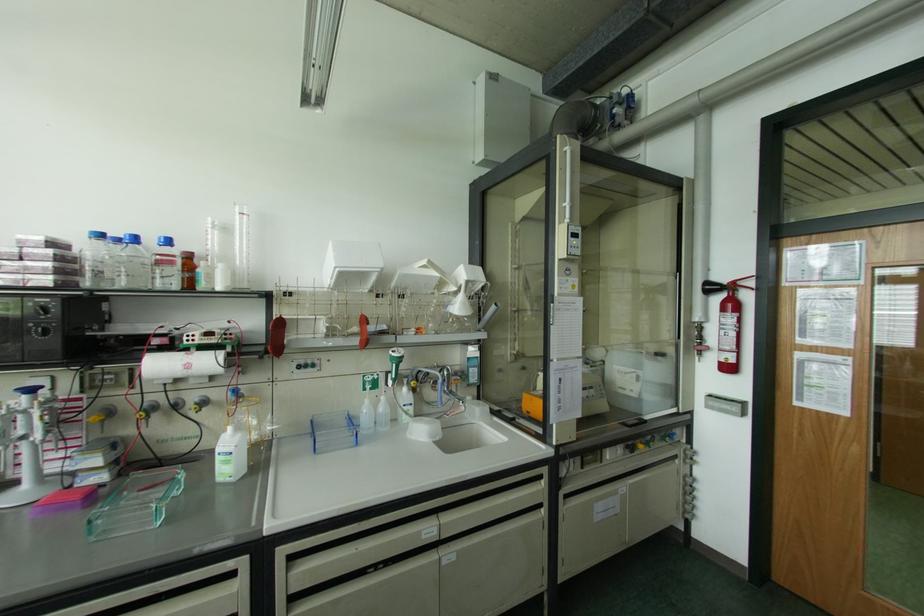
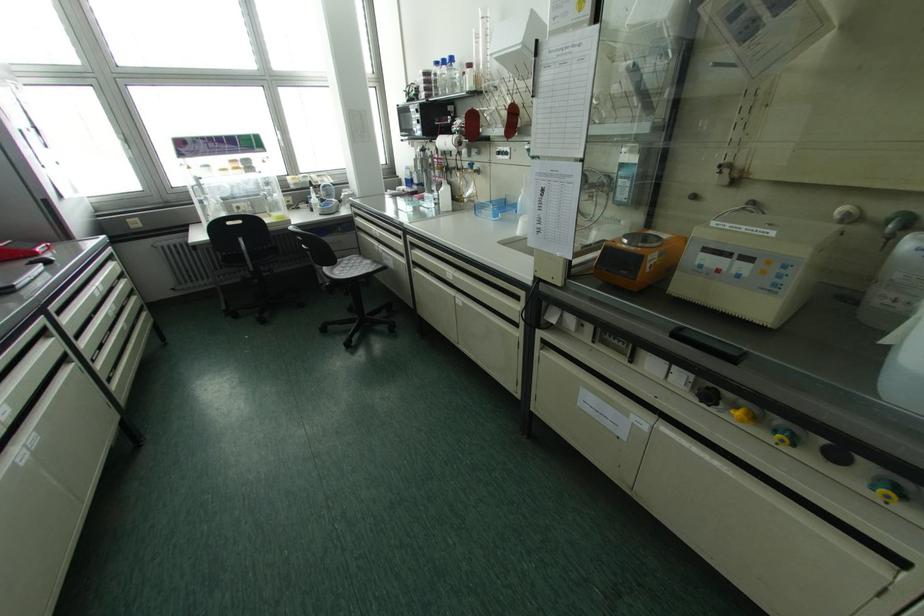
Where in the second image is the point corresponding to (167,241) from the first image?

(451, 59)